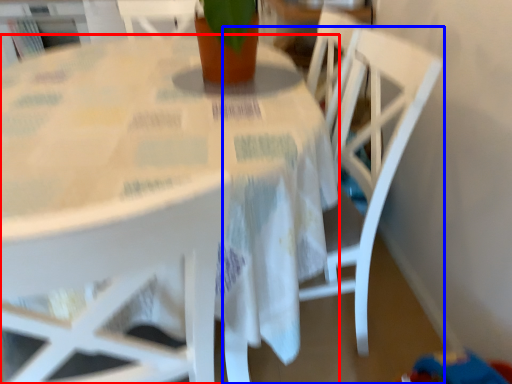
Question: Which object is further to the camera taking this photo, table (highlighted by a red box) or chair (highlighted by a blue box)?

Choices:
 (A) table
 (B) chair

Answer: (B)